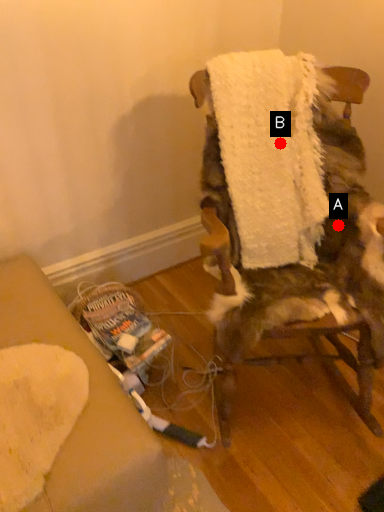
Question: Two points are circled on the image, labeled by A and B beside each circle. Which point appears closest to the camera in this image?

Choices:
 (A) A is closer
 (B) B is closer

Answer: (B)